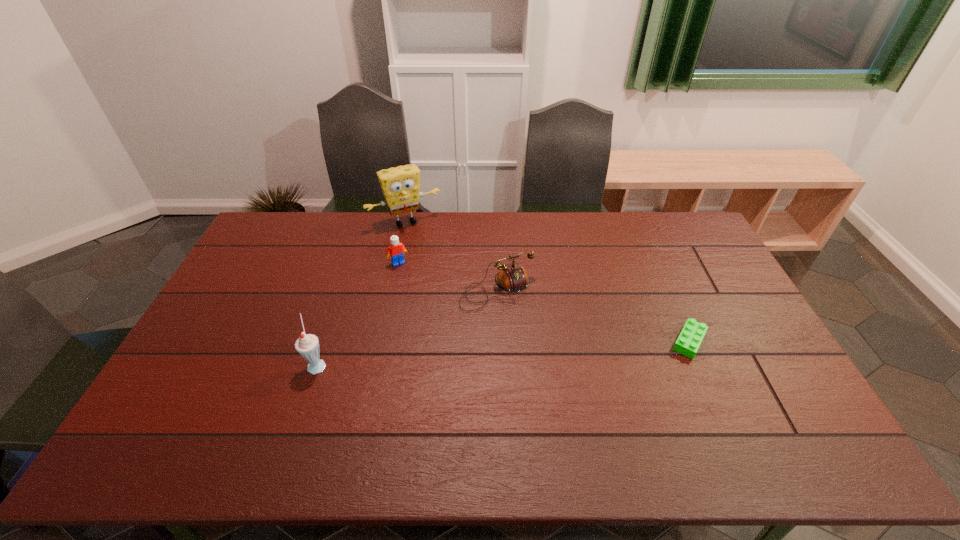
You are a GUI agent. You are given a task and a screenshot of the screen. Output one action in this format:
    pyautogui.click(x=<x>, y=<y>)
    Task: Click on the second tallest object
    The height and width of the screenshot is (540, 960).
    Given the screenshot: What is the action you would take?
    pyautogui.click(x=307, y=345)

Image resolution: width=960 pixels, height=540 pixels. What are the coordinates of `the shortest object` in the screenshot? It's located at (692, 334).

You are a GUI agent. You are given a task and a screenshot of the screen. Output one action in this format:
    pyautogui.click(x=<x>, y=<y>)
    Task: Click on the rightmost object
    The width and height of the screenshot is (960, 540).
    Given the screenshot: What is the action you would take?
    pyautogui.click(x=692, y=334)

Where is `sponge`? sponge is located at coordinates (401, 186).

Where is `the farthest object`? Image resolution: width=960 pixels, height=540 pixels. the farthest object is located at coordinates (401, 186).

Image resolution: width=960 pixels, height=540 pixels. What are the coordinates of `telephone` in the screenshot? It's located at (512, 278).

Where is `the third nearest object`? This screenshot has height=540, width=960. the third nearest object is located at coordinates (512, 278).

The width and height of the screenshot is (960, 540). I want to click on the fourth nearest object, so click(395, 251).

This screenshot has width=960, height=540. What are the coordinates of `the taller Lego` in the screenshot? It's located at (395, 251).

Where is `vacant space located 0.250m on the straw side of the fourth shortest object`? vacant space located 0.250m on the straw side of the fourth shortest object is located at coordinates (418, 364).